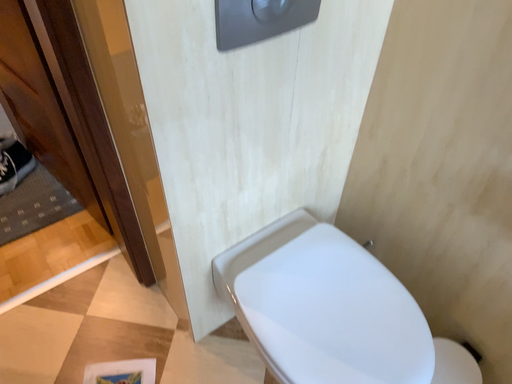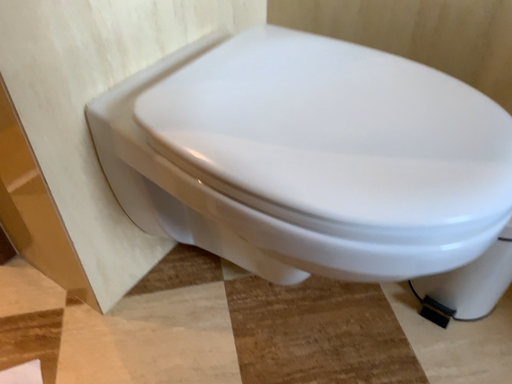
Question: Which way did the camera rotate in the video?

Choices:
 (A) rotated downward
 (B) rotated upward

Answer: (B)